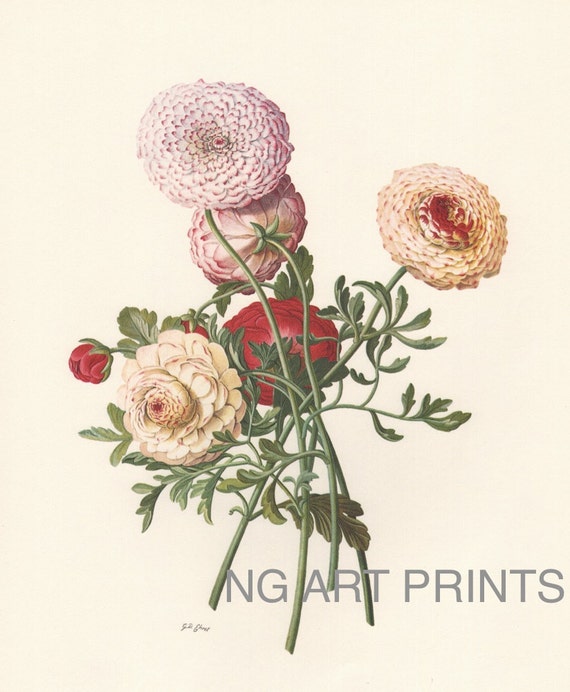
I want to click on prints, so click(x=472, y=588).